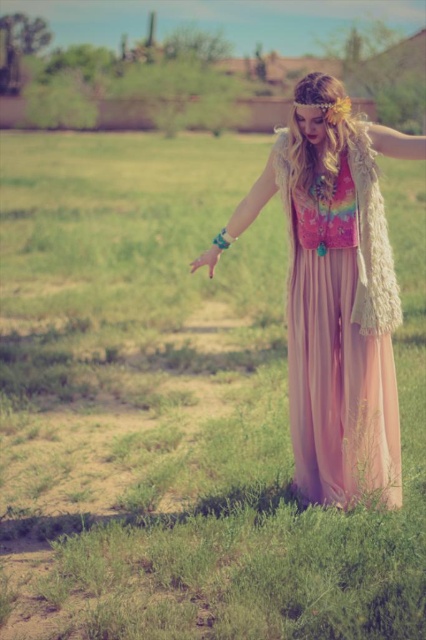
You are standing at the point labeled point (347, 148) and want to walk to the desert background. Which direction should you move to get closer to the desert background?

Since the desert background is in the background of the scene, you should move forward from point (347, 148) to get closer to the desert background.

Please provide the exact 2D coordinates of the pastel chiffon dress at center in the image. The coordinates should be in the format of a point with two decimal places, such as point 0.5,0.5.

The exact 2D coordinates of the pastel chiffon dress at center are point (334, 292).

You are a photographer planning to take a photo of the person in the scene. The camera frame can only accommodate the width of the pink chiffon dress at center. Will the pastel chiffon dress at center fit within the frame?

The pastel chiffon dress at center has a larger width than the pink chiffon dress at center, so it will not fit within the camera frame designed for the pink chiffon dress at center.